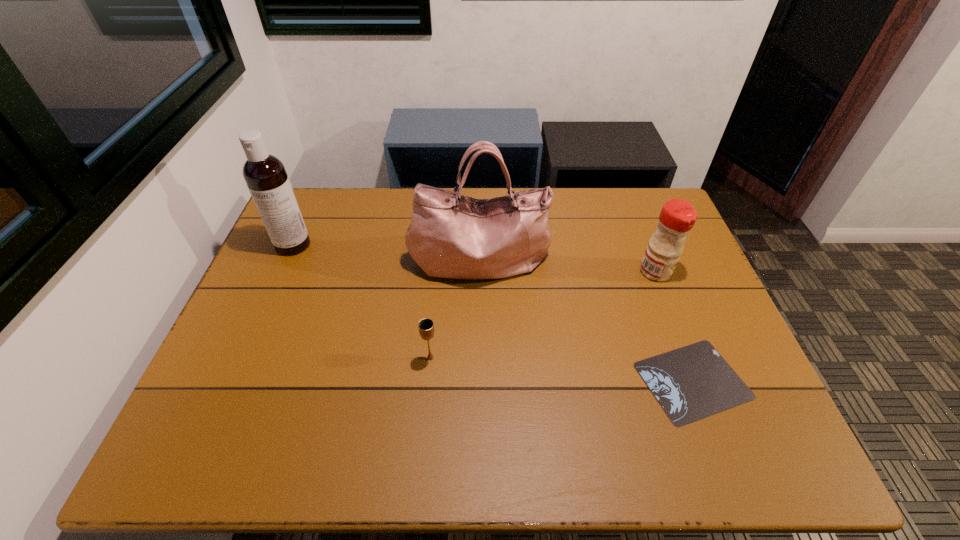
Where is `handbag`? The image size is (960, 540). handbag is located at coordinates (454, 236).

Find the location of a particular element. The image size is (960, 540). dishwasher detergent is located at coordinates (265, 175).

This screenshot has height=540, width=960. What are the coordinates of `condiment` in the screenshot? It's located at (677, 217).

Locate an element on the screen. This screenshot has height=540, width=960. chalice is located at coordinates (426, 327).

Where is `mousepad`? mousepad is located at coordinates (693, 382).

The image size is (960, 540). Find the location of `blank space located 0.170m at the front of the handbag with handles`. blank space located 0.170m at the front of the handbag with handles is located at coordinates (480, 336).

Image resolution: width=960 pixels, height=540 pixels. In order to click on free space located on the label side of the leftmost object in this screenshot , I will do `click(275, 288)`.

Locate an element on the screen. This screenshot has height=540, width=960. vacant area located on the front of the condiment is located at coordinates (701, 387).

This screenshot has height=540, width=960. What are the coordinates of `free spot located on the left of the fourth tallest object` in the screenshot? It's located at [x=392, y=357].

Where is `free location located 0.250m on the back of the shortest object`? free location located 0.250m on the back of the shortest object is located at coordinates (652, 272).